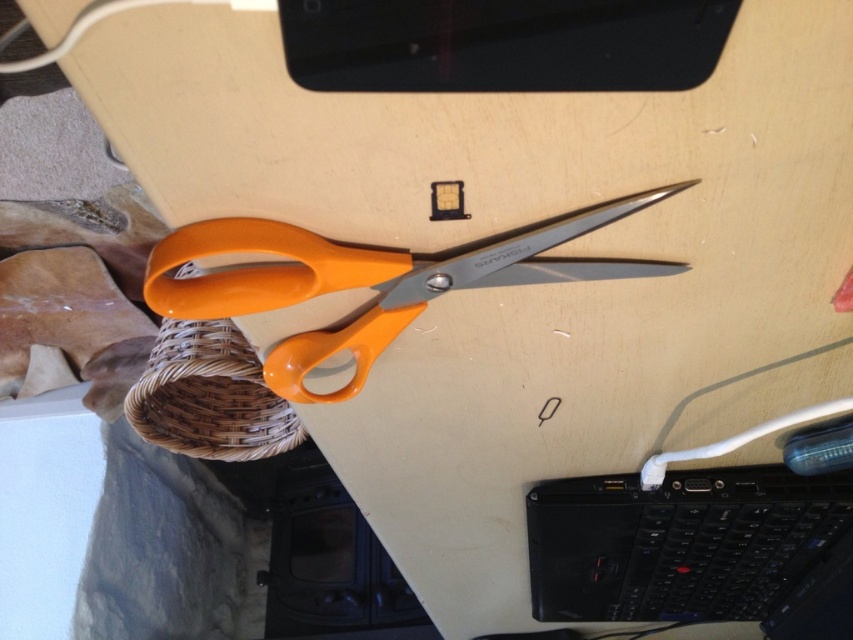
You need to place both the black plastic laptop at lower right and the orange plastic scissors at center into a storage box. If the box can only fit items up to the size of the scissors, will both items fit?

The black plastic laptop at lower right is larger in size than the orange plastic scissors at center, so it will not fit into the storage box designed for items up to the size of the scissors.

You need to place both the black plastic laptop at lower right and the orange plastic scissors at center into a box that can only hold items up to the size of the laptop. Which item will definitely fit, and why?

The orange plastic scissors at center will definitely fit because the black plastic laptop at lower right is wider than the orange plastic scissors at center, so the scissors are smaller and within the box size limit.

You are organizing items on a desk and need to place a new item between the black plastic laptop at lower right and the orange plastic scissors at center. Can you do this without moving either of them?

The black plastic laptop at lower right is further to the viewer than orange plastic scissors at center, so there is no space between them for placing a new item without moving either.